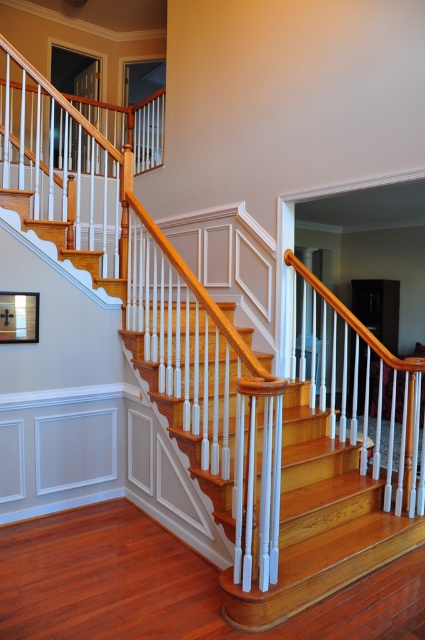
Question: Which point is closer to the camera taking this photo?

Choices:
 (A) (306, 448)
 (B) (5, 337)

Answer: (B)

Question: Among these objects, which one is farthest from the camera?

Choices:
 (A) light brown wood stairs at center
 (B) matte black picture frame at upper left

Answer: (B)

Question: Does light brown wood stairs at center appear on the right side of matte black picture frame at upper left?

Choices:
 (A) yes
 (B) no

Answer: (A)

Question: Does light brown wood stairs at center have a smaller size compared to matte black picture frame at upper left?

Choices:
 (A) yes
 (B) no

Answer: (B)

Question: Which point is farther to the camera?

Choices:
 (A) light brown wood stairs at center
 (B) matte black picture frame at upper left

Answer: (B)

Question: Is light brown wood stairs at center above matte black picture frame at upper left?

Choices:
 (A) yes
 (B) no

Answer: (B)